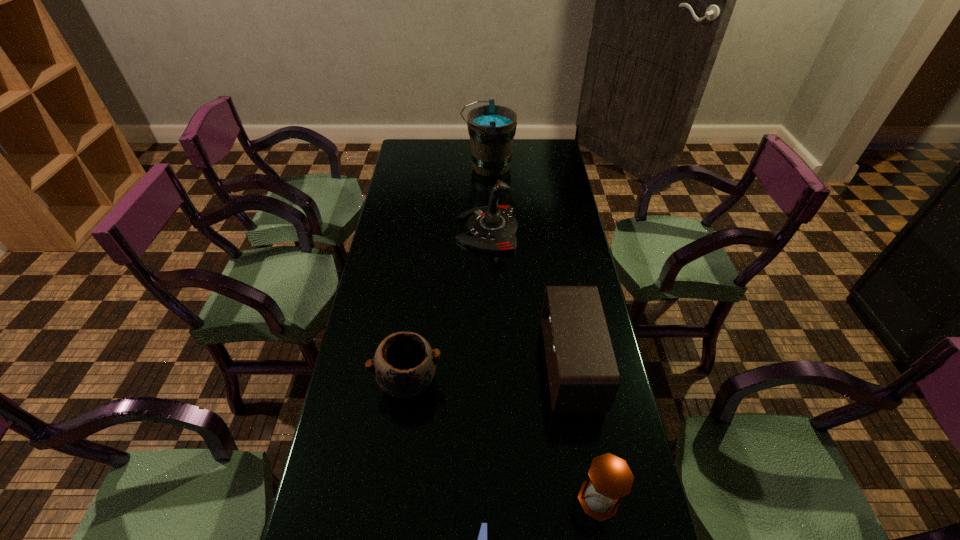
The image size is (960, 540). Find the location of `free space between the radio receiver and the second farthest object`. free space between the radio receiver and the second farthest object is located at coordinates (529, 298).

You are a GUI agent. You are given a task and a screenshot of the screen. Output one action in this format:
    pyautogui.click(x=<x>, y=<y>)
    Task: Click on the empty space between the farthest object and the joystick
    
    Given the screenshot: What is the action you would take?
    pyautogui.click(x=488, y=198)

This screenshot has width=960, height=540. Identify the location of vacant point located between the second farthest object and the leftmost object. (448, 306).

Locate an element on the screen. The height and width of the screenshot is (540, 960). vacant area that lies between the fifth farthest object and the second farthest object is located at coordinates (543, 364).

The height and width of the screenshot is (540, 960). Find the location of `object identified as the fourth closest to the fifth nearest object`. object identified as the fourth closest to the fifth nearest object is located at coordinates (610, 478).

Locate which object ranks fifth in proximity to the fifth farthest object. Please provide its 2D coordinates. Your answer should be formatted as a tuple, i.e. [(x, y)], where the tuple contains the x and y coordinates of a point satisfying the conditions above.

[(491, 128)]

The height and width of the screenshot is (540, 960). What are the coordinates of `vacant space that satisfies the following two spatial constraints: 1. on the handle side of the fifth shortest object; 2. on the left side of the fifth farthest object` in the screenshot? It's located at (492, 500).

Where is `free space that satisfies the following two spatial constraints: 1. on the front-facing side of the second nearest object; 2. on the left side of the radio receiver`? This screenshot has height=540, width=960. free space that satisfies the following two spatial constraints: 1. on the front-facing side of the second nearest object; 2. on the left side of the radio receiver is located at coordinates (593, 500).

Locate an element on the screen. This screenshot has width=960, height=540. free region that satisfies the following two spatial constraints: 1. on the handle side of the joystick; 2. on the left side of the second nearest object is located at coordinates (492, 500).

This screenshot has height=540, width=960. I want to click on blank area in the image that satisfies the following two spatial constraints: 1. on the handle side of the joystick; 2. on the left side of the hourglass, so tap(492, 500).